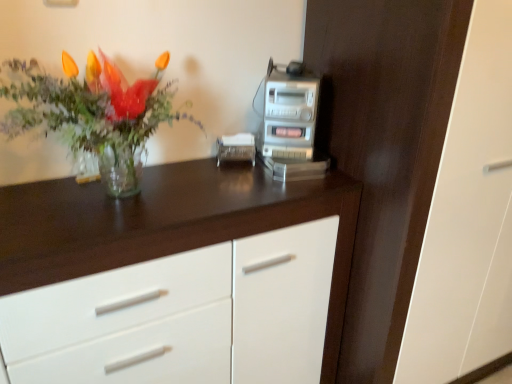
This screenshot has height=384, width=512. I want to click on vacant area on top of white glossy chest of drawers at center (from a real-world perspective), so click(x=146, y=198).